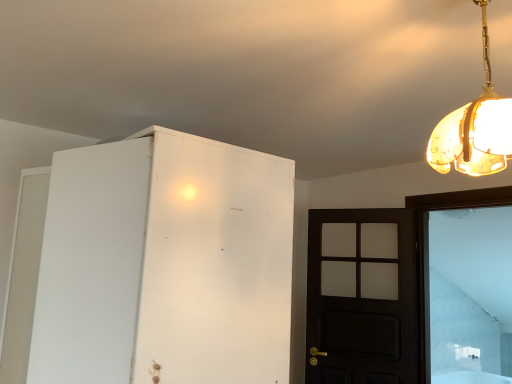
Question: Considering the positions of dark wood door at right and white glass door at right in the image, is dark wood door at right bigger or smaller than white glass door at right?

Choices:
 (A) big
 (B) small

Answer: (B)

Question: Considering the positions of dark wood door at right and white glass door at right in the image, is dark wood door at right wider or thinner than white glass door at right?

Choices:
 (A) wide
 (B) thin

Answer: (B)

Question: Estimate the real-world distances between objects in this image. Which object is farther from the translucent amber glass pendant light at upper right?

Choices:
 (A) white glass door at right
 (B) white matte cabinet at left
 (C) dark wood door at right

Answer: (A)

Question: Which is nearer to the white matte cabinet at left?

Choices:
 (A) dark wood door at right
 (B) translucent amber glass pendant light at upper right
 (C) white glass door at right

Answer: (B)